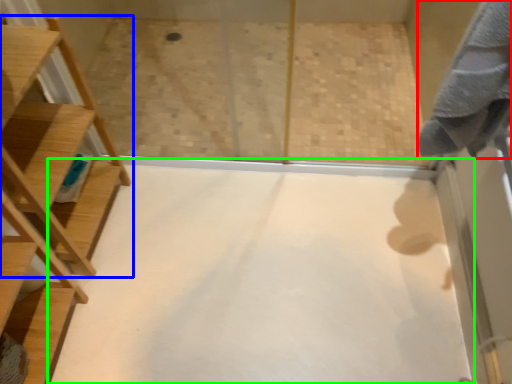
Question: Which object is the closest to the bath towel (highlighted by a red box)? Choose among these: furniture (highlighted by a blue box) or plain (highlighted by a green box).

Choices:
 (A) furniture
 (B) plain

Answer: (B)